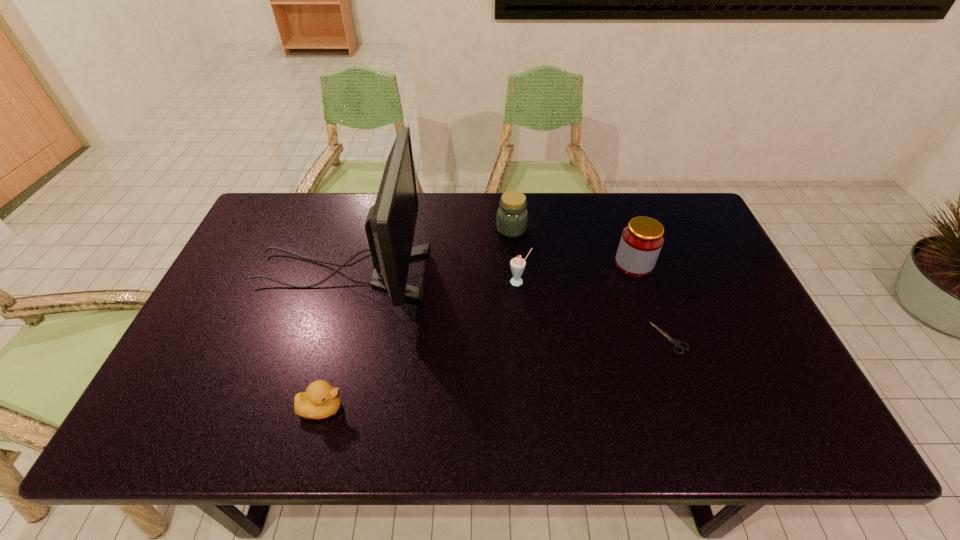
Where is `free space between the left jar and the right jar`? This screenshot has height=540, width=960. free space between the left jar and the right jar is located at coordinates (573, 246).

In order to click on vacant space in between the duckling and the shortest object in this screenshot , I will do `click(496, 373)`.

Where is `vacant space that's between the farther jar and the milkshake`? This screenshot has height=540, width=960. vacant space that's between the farther jar and the milkshake is located at coordinates (516, 255).

Image resolution: width=960 pixels, height=540 pixels. What are the coordinates of `the fourth closest object relative to the farther jar` in the screenshot? It's located at (676, 344).

I want to click on object that is the third nearest to the computer monitor, so click(517, 264).

This screenshot has height=540, width=960. In order to click on vacant space that satisfies the following two spatial constraints: 1. on the front side of the farther jar; 2. on the screen side of the tallest object in this screenshot , I will do `click(515, 273)`.

Locate an element on the screen. free space that satisfies the following two spatial constraints: 1. on the front side of the shortest object; 2. on the right side of the farther jar is located at coordinates (520, 338).

Locate an element on the screen. The image size is (960, 540). free location that satisfies the following two spatial constraints: 1. on the screen side of the computer monitor; 2. on the back side of the shortest object is located at coordinates (323, 338).

This screenshot has width=960, height=540. In order to click on vacant space that satisfies the following two spatial constraints: 1. on the front side of the left jar; 2. on the right side of the nearer jar in this screenshot , I will do `click(515, 264)`.

Identify the location of free spot that satisfies the following two spatial constraints: 1. on the front side of the shorter jar; 2. on the left side of the nearer jar. (515, 264).